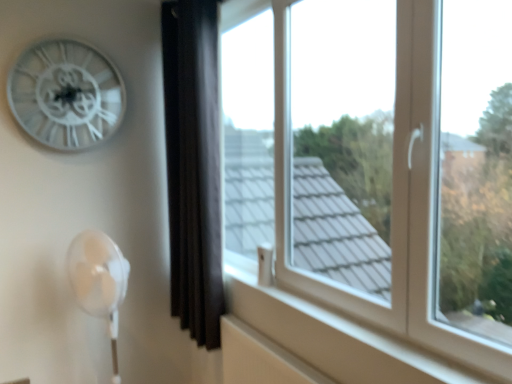
Question: Would you say transparent glass window at center is to the left or to the right of black velvet curtain at center in the picture?

Choices:
 (A) right
 (B) left

Answer: (A)

Question: Do you think transparent glass window at center is within black velvet curtain at center, or outside of it?

Choices:
 (A) outside
 (B) inside

Answer: (A)

Question: Which is farther from the white metallic clock at upper left?

Choices:
 (A) black velvet curtain at center
 (B) transparent glass window at center

Answer: (B)

Question: Which object is the closest to the black velvet curtain at center?

Choices:
 (A) transparent glass window at center
 (B) white metallic clock at upper left

Answer: (A)